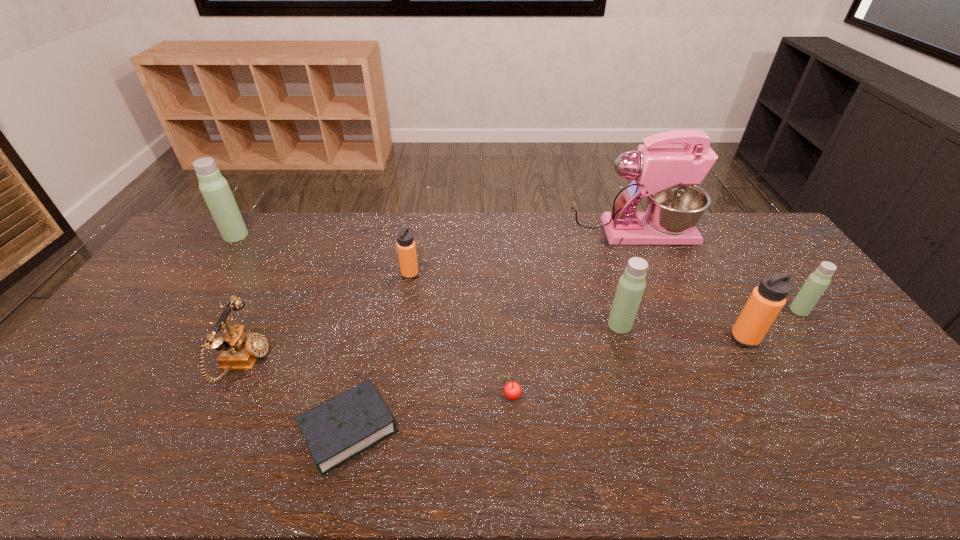
I want to click on vacant point located between the eighth tallest object and the telephone, so click(x=377, y=380).

Image resolution: width=960 pixels, height=540 pixels. Find the location of `free space between the telephone and the second thermos bottle from left to right`. free space between the telephone and the second thermos bottle from left to right is located at coordinates (327, 319).

Locate an element on the screen. This screenshot has height=540, width=960. free area in between the shortest object and the right orange thermos bottle is located at coordinates pyautogui.click(x=547, y=384).

You are a GUI agent. You are given a task and a screenshot of the screen. Output one action in this format:
    pyautogui.click(x=<x>, y=<y>)
    Task: Click on the free point between the tallest object and the second shortest object
    The width and height of the screenshot is (960, 540).
    Given the screenshot: What is the action you would take?
    pyautogui.click(x=569, y=315)

Image resolution: width=960 pixels, height=540 pixels. I want to click on free space between the Bible and the rightmost light thermos bottle, so click(574, 370).

At what (x,y) coordinates should I click in order to perform the action: click on free space between the farther orange thermos bottle and the tallest object. Please return your answer as a coordinate pair (x, y). The width and height of the screenshot is (960, 540). Looking at the image, I should click on pos(520,254).

Image resolution: width=960 pixels, height=540 pixels. I want to click on free spot between the rightmost object and the black Bible, so click(574, 370).

You are a GUI agent. You are given a task and a screenshot of the screen. Output one action in this format:
    pyautogui.click(x=<x>, y=<y>)
    Task: Click on the eighth closest object to the second light thermos bottle from left to right
    This screenshot has height=540, width=960.
    Given the screenshot: What is the action you would take?
    pyautogui.click(x=214, y=188)

Identify which object is the third nearest to the second smallest light thermos bottle. Please provide its 2D coordinates. Your answer should be formatted as a tuple, i.e. [(x, y)], where the tuple contains the x and y coordinates of a point satisfying the conditions above.

[(512, 390)]

You are a GUI agent. You are given a task and a screenshot of the screen. Output one action in this format:
    pyautogui.click(x=<x>, y=<y>)
    Task: Click on the thermos bottle that is the fourth closest to the fourth thermos bottle from left to right
    
    Given the screenshot: What is the action you would take?
    pyautogui.click(x=214, y=188)